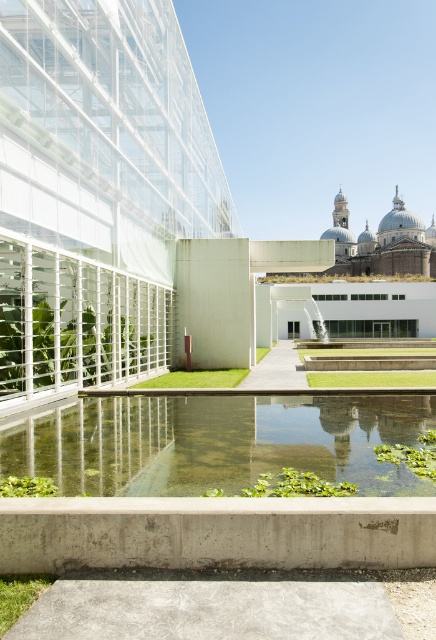
In the scene shown: You are standing in the modern architectural scene and want to step onto the clear water pond at center and the clear glass water feature at center. Which one can you step onto first?

The clear water pond at center is closer to the viewer than the clear glass water feature at center, so you can step onto the clear water pond at center first.

You are an architect designing a new landscape feature. You have to choose between placing a tall sculpture in either the clear water pond at center or the clear glass water feature at center. Based on their heights, which location would you choose to ensure the sculpture remains visible above the water surface?

The clear glass water feature at center has a greater height than the clear water pond at center. Therefore, placing the tall sculpture in the clear glass water feature at center would ensure it remains visible above the water surface.